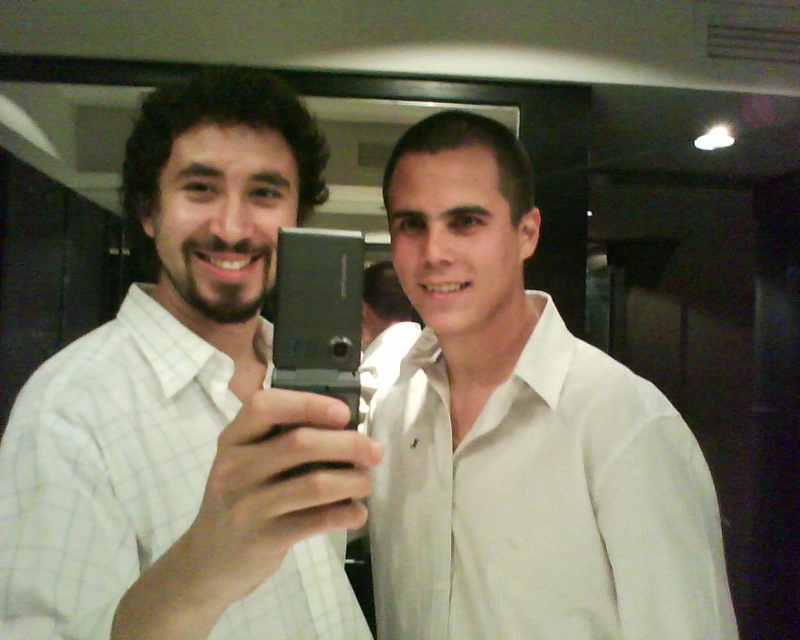
You are an interior designer analyzing the lighting in the room where the two people are taking a selfie. The white textured shirt at center is represented by point (542, 504). Based on the lighting, which direction should the individuals move to ensure their shirts receive more even illumination?

The white textured shirt at center is represented by point (542, 504). To ensure even illumination, the individuals should move towards the light source, which is likely coming from the direction opposite to the shadows cast by their shirts.

You are a photographer trying to adjust the lighting for a group photo. You notice two shirts in the frame, the white textured shirt at center and the white checkered shirt at center. Which shirt should you focus on to ensure proper exposure since it is positioned higher in the frame?

The white textured shirt at center is located above the white checkered shirt at center, so focusing on the white textured shirt at center would ensure proper exposure as it is higher in the frame.

You are a photographer trying to adjust the focus of your camera. You notice two points in the image at coordinates point (606, 632) and point (134, 332). Which point is closer to the camera lens?

Point (606, 632) is further to the camera than point (134, 332), so the point closer to the camera lens is point (134, 332).